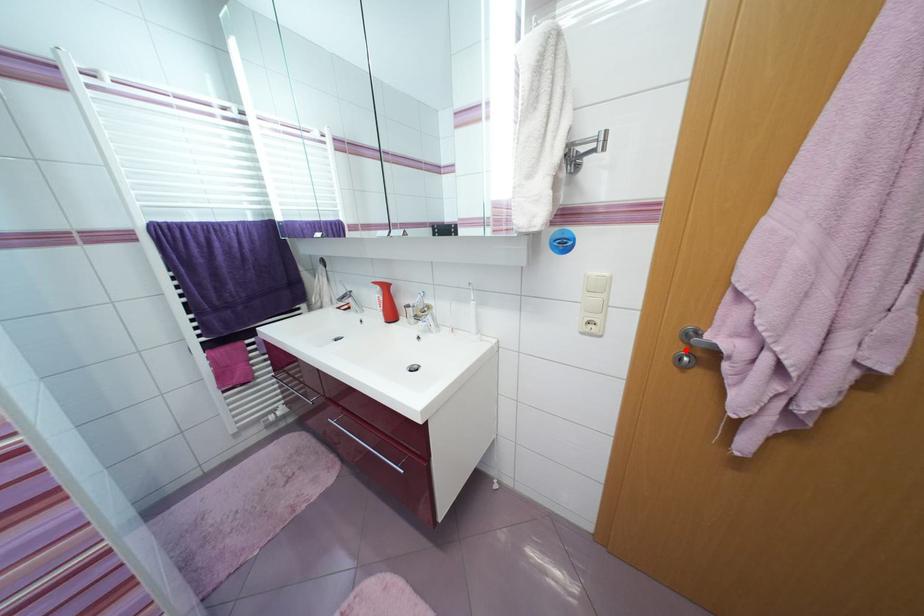
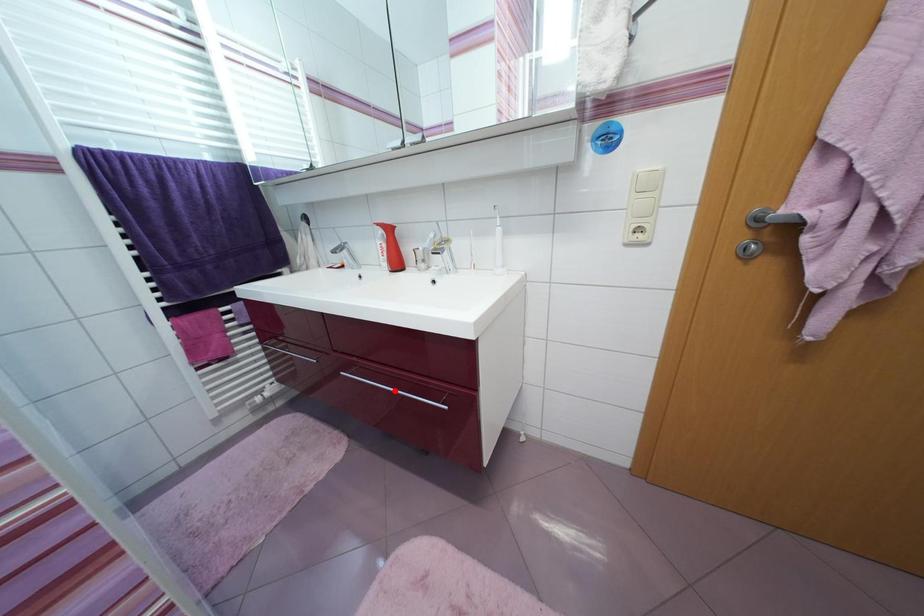
I am providing you with two images of the same scene from different viewpoints. A red point is marked on the first image and another point is marked on the second image. Does the point marked in image1 correspond to the same location as the one in image2?

No